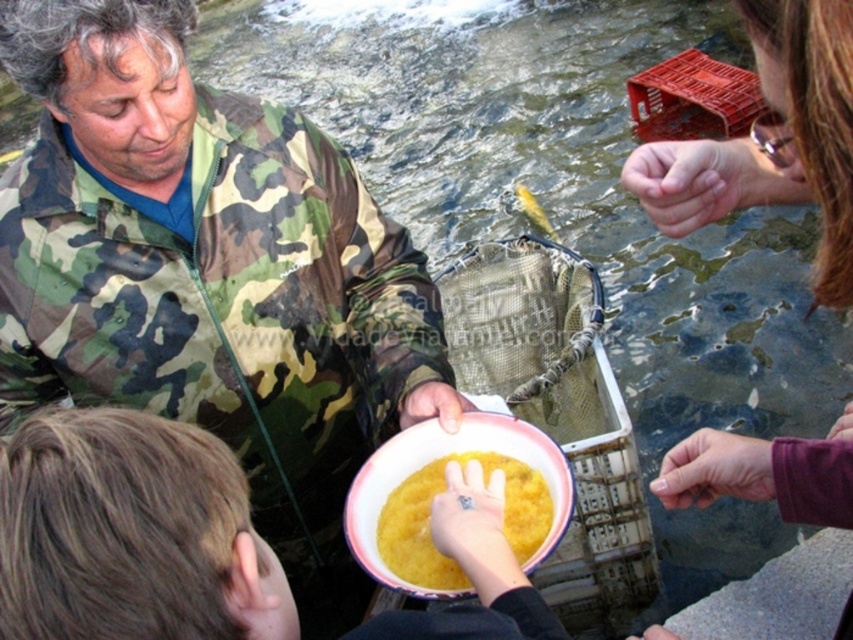
Question: Is camouflage jacket at center behind yellow matte food at center?

Choices:
 (A) no
 (B) yes

Answer: (B)

Question: From the image, what is the correct spatial relationship of matte green camouflage jacket at center in relation to yellow matte food at center?

Choices:
 (A) above
 (B) below

Answer: (A)

Question: Considering the real-world distances, which object is closest to the yellow matte food at center?

Choices:
 (A) camouflage jacket at center
 (B) matte green camouflage jacket at center
 (C) yellow shiny fish at center

Answer: (B)

Question: Which is farther from the yellow shiny fish at center?

Choices:
 (A) matte green camouflage jacket at center
 (B) smooth skin hand at upper right
 (C) yellow matte food at center
 (D) camouflage jacket at center

Answer: (B)

Question: Which of these objects is positioned farthest from the yellow matte food at center?

Choices:
 (A) smooth skin hand at upper right
 (B) yellow shiny fish at center
 (C) camouflage jacket at center

Answer: (B)

Question: In this image, where is camouflage jacket at center located relative to smooth skin hand at upper right?

Choices:
 (A) above
 (B) below

Answer: (B)